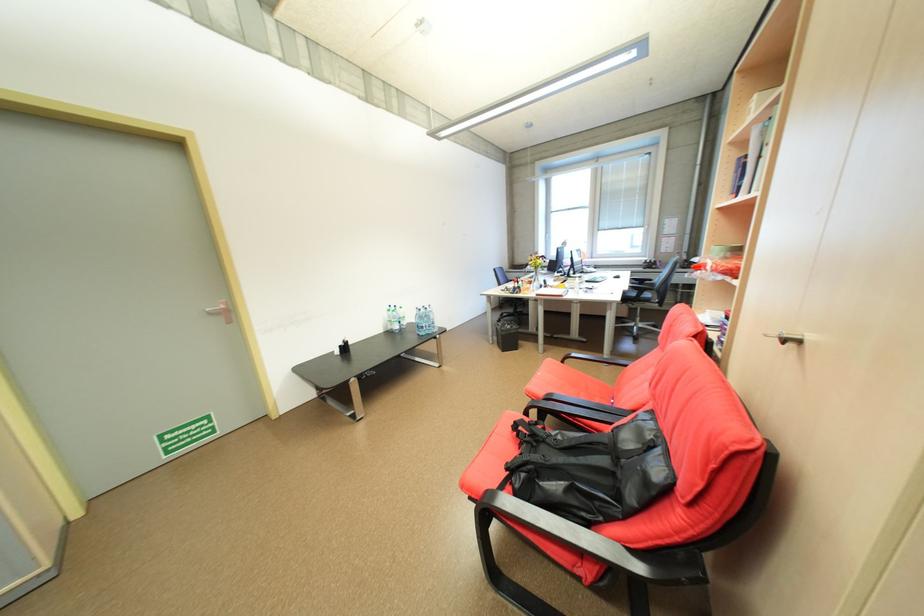
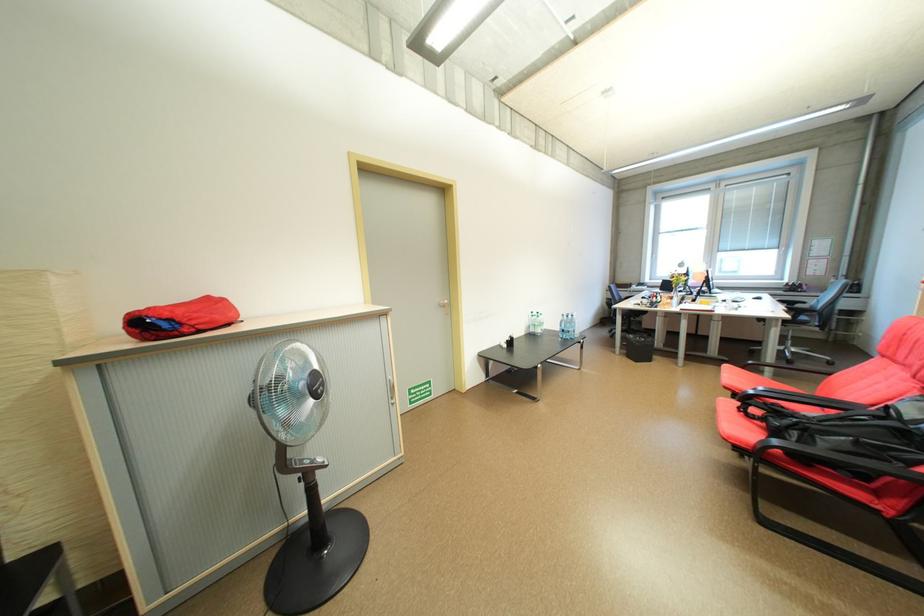
Find the pixel in the second image that matches point 618,275 in the first image.

(758, 296)